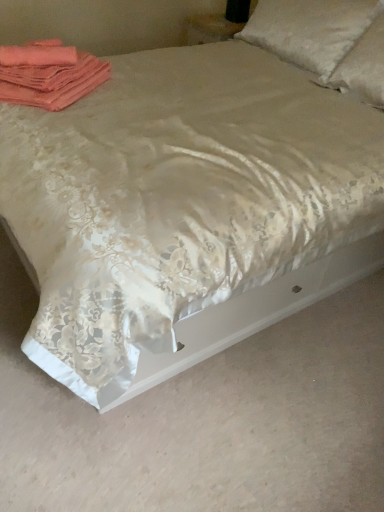
Question: Based on their positions, is satin white pillow at upper right, the first pillow in the right-to-left sequence, located to the left or right of white satin pillow at upper right, the second pillow from the right?

Choices:
 (A) right
 (B) left

Answer: (A)

Question: From the image's perspective, relative to white satin pillow at upper right, which is the first pillow in left-to-right order, is satin white pillow at upper right, the first pillow in the right-to-left sequence, above or below?

Choices:
 (A) below
 (B) above

Answer: (A)

Question: Considering the real-world distances, which object is farthest from the coral fabric towels at upper left?

Choices:
 (A) white satin pillow at upper right, which is the first pillow in left-to-right order
 (B) satin white pillow at upper right, the 2th pillow from the left

Answer: (B)

Question: Based on their relative distances, which object is farther from the coral fabric towels at upper left?

Choices:
 (A) white satin pillow at upper right, which is the first pillow in left-to-right order
 (B) satin white pillow at upper right, the 2th pillow from the left

Answer: (B)